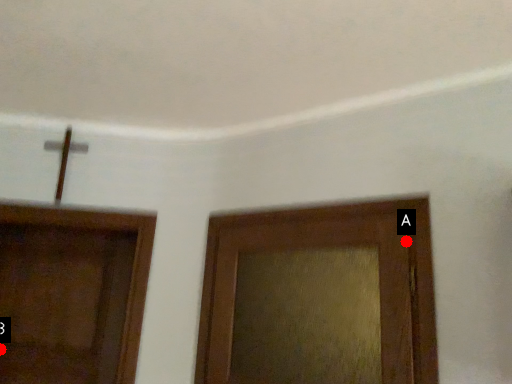
Question: Two points are circled on the image, labeled by A and B beside each circle. Which point is closer to the camera taking this photo?

Choices:
 (A) A is closer
 (B) B is closer

Answer: (A)